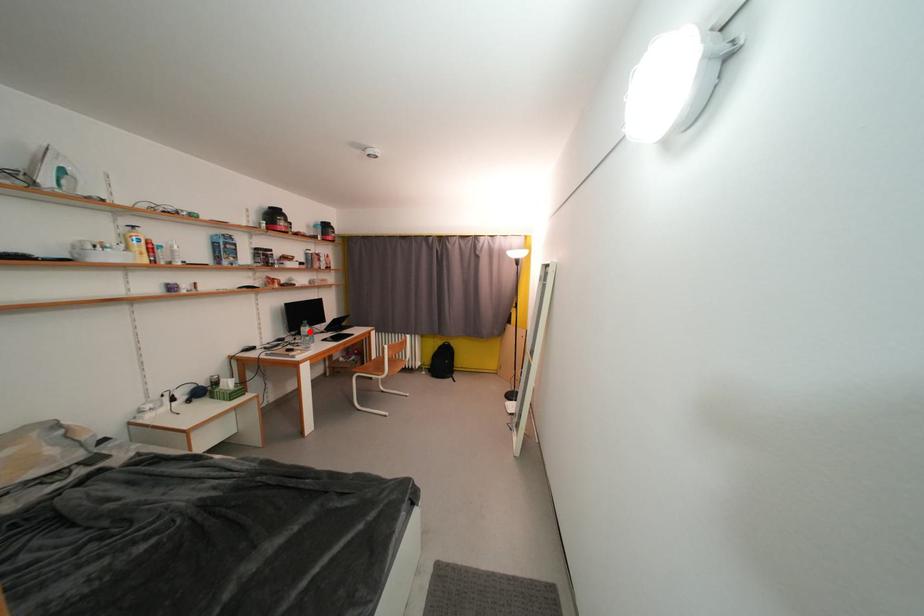
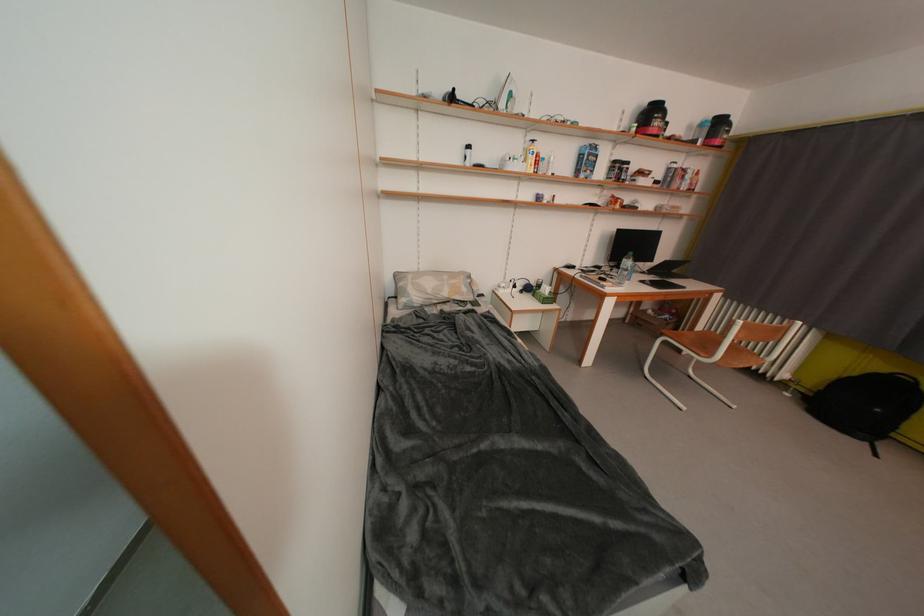
Question: I am providing you with two images of the same scene from different viewpoints. In image1, a red point is highlighted. Considering the same 3D point in image2, which of the following is correct?

Choices:
 (A) It is closer
 (B) It is farther

Answer: (B)